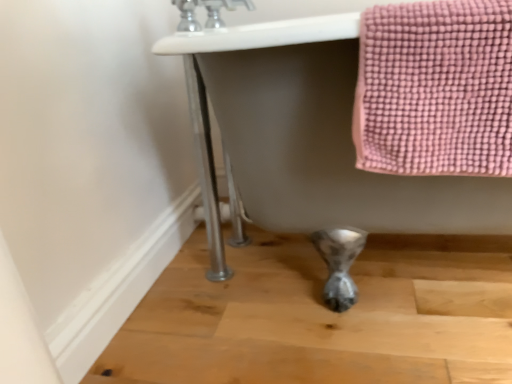
Question: Visually, is white glossy bathtub at center positioned to the left or to the right of silver metallic faucet at upper center?

Choices:
 (A) right
 (B) left

Answer: (A)

Question: Considering the positions of white glossy bathtub at center and silver metallic faucet at upper center in the image, is white glossy bathtub at center wider or thinner than silver metallic faucet at upper center?

Choices:
 (A) thin
 (B) wide

Answer: (B)

Question: From the image's perspective, is white glossy bathtub at center above or below silver metallic faucet at upper center?

Choices:
 (A) above
 (B) below

Answer: (B)

Question: From the image's perspective, is silver metallic faucet at upper center positioned above or below white glossy bathtub at center?

Choices:
 (A) above
 (B) below

Answer: (A)

Question: Based on their sizes in the image, would you say silver metallic faucet at upper center is bigger or smaller than white glossy bathtub at center?

Choices:
 (A) big
 (B) small

Answer: (B)

Question: Based on their positions, is silver metallic faucet at upper center located to the left or right of white glossy bathtub at center?

Choices:
 (A) left
 (B) right

Answer: (A)

Question: Choose the correct answer: Is silver metallic faucet at upper center inside white glossy bathtub at center or outside it?

Choices:
 (A) outside
 (B) inside

Answer: (A)